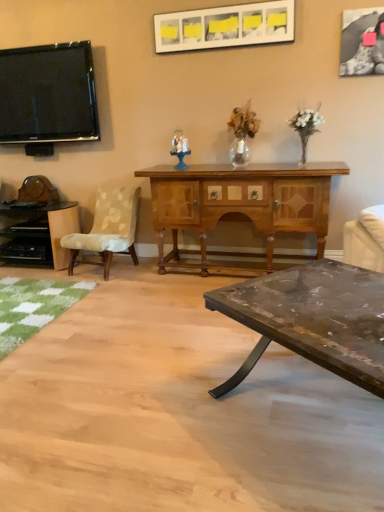
Question: Is wooden cabinet at center, which is counted as the 1th desk, starting from the right, oriented towards black textured fabric picture frame at upper right, positioned as the 1th picture frame in right-to-left order?

Choices:
 (A) no
 (B) yes

Answer: (A)

Question: Is black textured fabric picture frame at upper right, positioned as the second picture frame in left-to-right order, a part of wooden cabinet at center, which is counted as the 1th desk, starting from the right?

Choices:
 (A) no
 (B) yes

Answer: (A)

Question: Considering the relative sizes of wooden cabinet at center, the 2th desk viewed from the left, and black textured fabric picture frame at upper right, positioned as the 1th picture frame in right-to-left order, in the image provided, is wooden cabinet at center, the 2th desk viewed from the left, taller than black textured fabric picture frame at upper right, positioned as the 1th picture frame in right-to-left order,?

Choices:
 (A) yes
 (B) no

Answer: (A)

Question: Can you confirm if wooden cabinet at center, which is counted as the 1th desk, starting from the right, is shorter than black textured fabric picture frame at upper right, positioned as the second picture frame in left-to-right order?

Choices:
 (A) no
 (B) yes

Answer: (A)

Question: Is wooden cabinet at center, the 2th desk viewed from the left, touching black textured fabric picture frame at upper right, positioned as the 1th picture frame in right-to-left order?

Choices:
 (A) yes
 (B) no

Answer: (B)

Question: Is rustic wood coffee table at lower right bigger or smaller than white glossy picture frame at upper center, acting as the 1th picture frame starting from the left?

Choices:
 (A) small
 (B) big

Answer: (B)

Question: Considering their positions, is rustic wood coffee table at lower right located in front of or behind white glossy picture frame at upper center, acting as the 1th picture frame starting from the left?

Choices:
 (A) behind
 (B) front

Answer: (B)

Question: In terms of width, does rustic wood coffee table at lower right look wider or thinner when compared to white glossy picture frame at upper center, acting as the 1th picture frame starting from the left?

Choices:
 (A) thin
 (B) wide

Answer: (B)

Question: From the image's perspective, is rustic wood coffee table at lower right above or below white glossy picture frame at upper center, arranged as the 2th picture frame when viewed from the right?

Choices:
 (A) below
 (B) above

Answer: (A)

Question: Does point (77, 84) appear closer or farther from the camera than point (135, 204)?

Choices:
 (A) farther
 (B) closer

Answer: (B)

Question: Is flat screen tv at upper left taller or shorter than beige fabric chair at left?

Choices:
 (A) tall
 (B) short

Answer: (A)

Question: Based on their positions, is flat screen tv at upper left located to the left or right of beige fabric chair at left?

Choices:
 (A) right
 (B) left

Answer: (B)

Question: Considering the positions of flat screen tv at upper left and beige fabric chair at left in the image, is flat screen tv at upper left bigger or smaller than beige fabric chair at left?

Choices:
 (A) small
 (B) big

Answer: (A)

Question: Is rustic wood coffee table at lower right wider or thinner than translucent glass figurine at center?

Choices:
 (A) wide
 (B) thin

Answer: (A)

Question: Is rustic wood coffee table at lower right inside the boundaries of translucent glass figurine at center, or outside?

Choices:
 (A) inside
 (B) outside

Answer: (B)